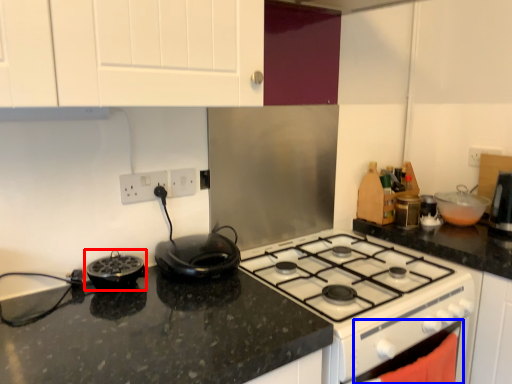
Question: Which point is further to the camera, kitchen appliance (highlighted by a red box) or oven (highlighted by a blue box)?

Choices:
 (A) kitchen appliance
 (B) oven

Answer: (A)